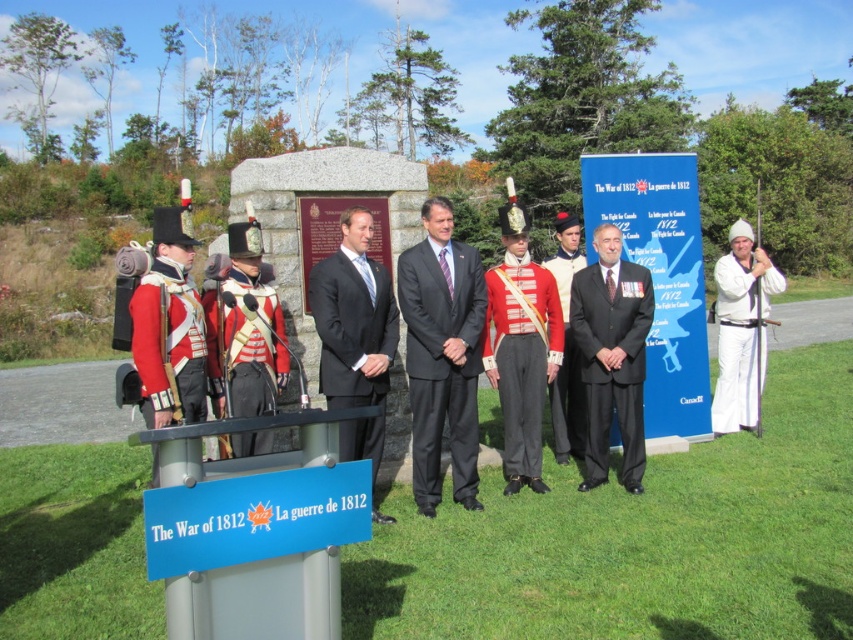
Is matte black suit at center to the left of white matte suit at center from the viewer's perspective?

Correct, you'll find matte black suit at center to the left of white matte suit at center.

Does matte black suit at center lie behind white matte suit at center?

That is False.

Between point (364, 451) and point (738, 323), which one is positioned behind?

The point (738, 323) is more distant.

Image resolution: width=853 pixels, height=640 pixels. In order to click on matte black suit at center in this screenshot , I will do `click(352, 317)`.

Identify the location of red and white uniform at center. (245, 323).

Is red and white uniform at center taller than red wool uniform at center?

No, red and white uniform at center is not taller than red wool uniform at center.

Where is `red and white uniform at center`? This screenshot has width=853, height=640. red and white uniform at center is located at coordinates (245, 323).

Does red woolen coat at center appear under red and white uniform at center?

Indeed, red woolen coat at center is positioned under red and white uniform at center.

Between point (544, 358) and point (241, 232), which one is positioned behind?

The point (544, 358) is more distant.

Does point (508, 256) lie in front of point (244, 243)?

No, it is not.

The image size is (853, 640). I want to click on red woolen coat at center, so click(x=521, y=355).